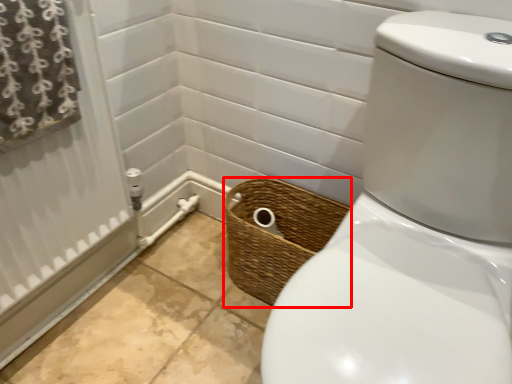
Question: Where is basket (annotated by the red box) located in relation to curtain in the image?

Choices:
 (A) left
 (B) right

Answer: (B)